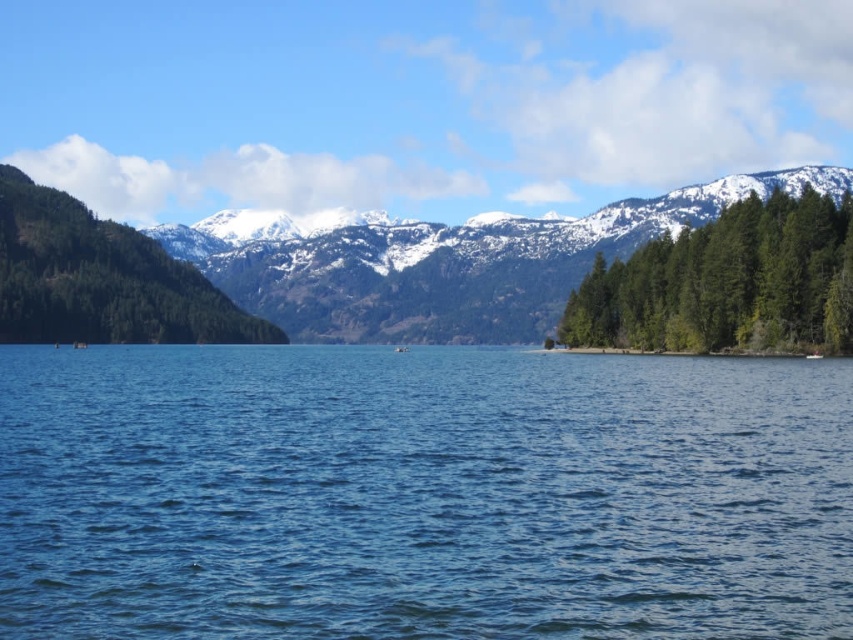
You are an environmental scientist analyzing the landscape. You need to determine which area covers more horizontal space in the image between the snowy forested mountain at center and the green textured trees at right. Based on the scene, which one has a greater width?

The snowy forested mountain at center has a greater width than the green textured trees at right according to the description.

You are standing on the lakeshore and want to take a photo that includes both the blue water at center and the green textured forest at left. Based on their positions, which object should you frame first in your camera viewfinder to ensure both are visible?

Since the blue water at center is to the right of the green textured forest at left, you should frame the green textured forest at left first in your camera viewfinder to ensure both are visible in the photo.

Consider the image. You are standing at the edge of the lake and want to place a buoy exactly at the center of the blue water at center. According to the coordinates provided, where should you place the buoy?

The blue water at center is located at point coordinates of [421,493], so you should place the buoy at those coordinates to mark its center.